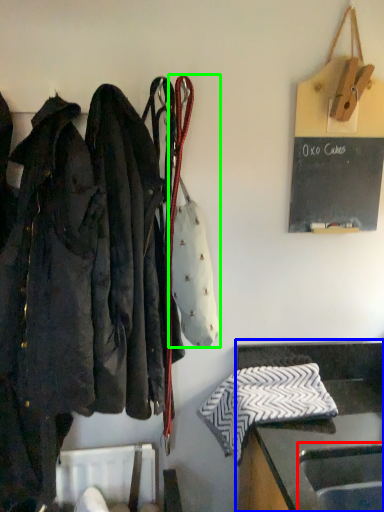
Question: Which object is positioned farthest from sink (highlighted by a red box)? Select from furniture (highlighted by a blue box) and handbag (highlighted by a green box).

Choices:
 (A) furniture
 (B) handbag

Answer: (B)